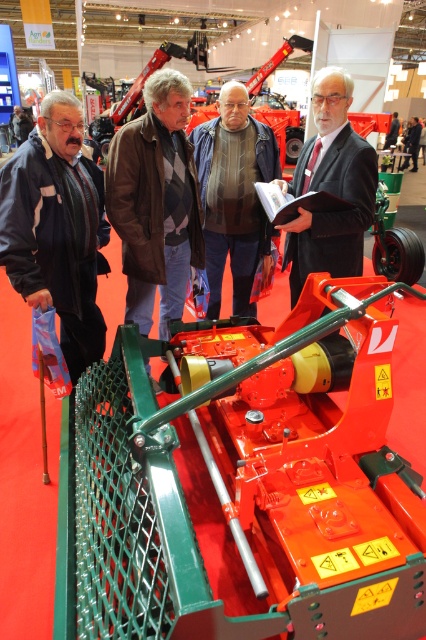
You are attending an agricultural machinery exhibition and notice two coats in the foreground. The dark blue jacket at left and the brown woolen coat at center. Which one is smaller in size?

The dark blue jacket at left has a smaller size compared to the brown woolen coat at center.

You are a fashion designer observing the trade show and want to place a new accessory between the brown leather jacket at center and the matte black suit at center. Is there enough space to fit the accessory, which is 20 inches long?

The brown leather jacket at center and the matte black suit at center are 22.70 inches apart, so yes, the accessory can fit between them as it is shorter than the available space.

You are a fashion designer observing a trade show. You notice two items at the center of the scene. Which item is taller between the brown woolen coat at center and the matte black suit at center?

The brown woolen coat at center is taller than the matte black suit at center.